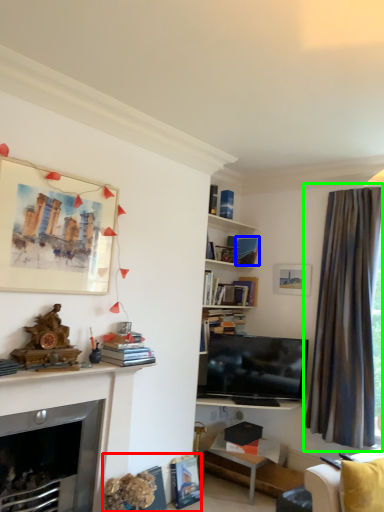
Question: Which is farther away from book (highlighted by a red box)? book (highlighted by a blue box) or curtain (highlighted by a green box)?

Choices:
 (A) book
 (B) curtain

Answer: (A)